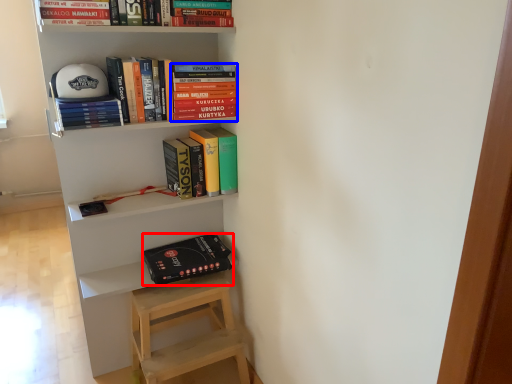
Question: Which of the following is the closest to the observer, paperback book (highlighted by a red box) or book (highlighted by a blue box)?

Choices:
 (A) paperback book
 (B) book

Answer: (B)